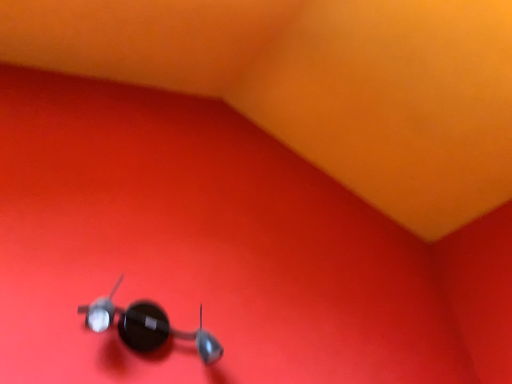
Image resolution: width=512 pixels, height=384 pixels. Describe the element at coordinates (147, 326) in the screenshot. I see `shiny black earrings at bottom center` at that location.

Identify the location of shiny black earrings at bottom center. (147, 326).

What is the approximate height of shiny black earrings at bottom center?

6.42 inches.

Identify the location of shiny black earrings at bottom center. (147, 326).